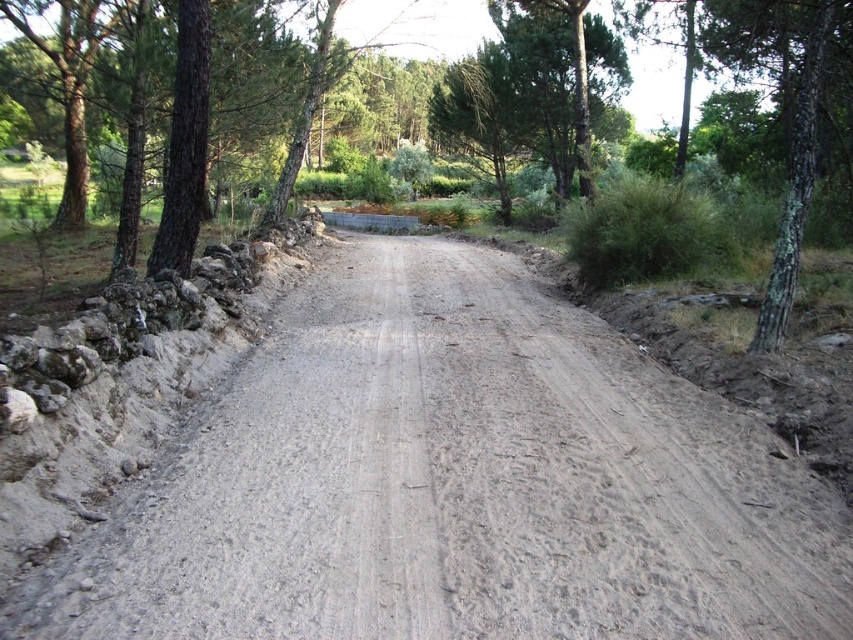
Does gray sandy dirt track at center have a larger size compared to green rough bark tree at right?

No.

Is gray sandy dirt track at center behind green rough bark tree at right?

No, it is in front of green rough bark tree at right.

Between point (831, 508) and point (828, 26), which one is positioned in front?

Point (831, 508) is more forward.

Where is `gray sandy dirt track at center`? This screenshot has width=853, height=640. gray sandy dirt track at center is located at coordinates (454, 484).